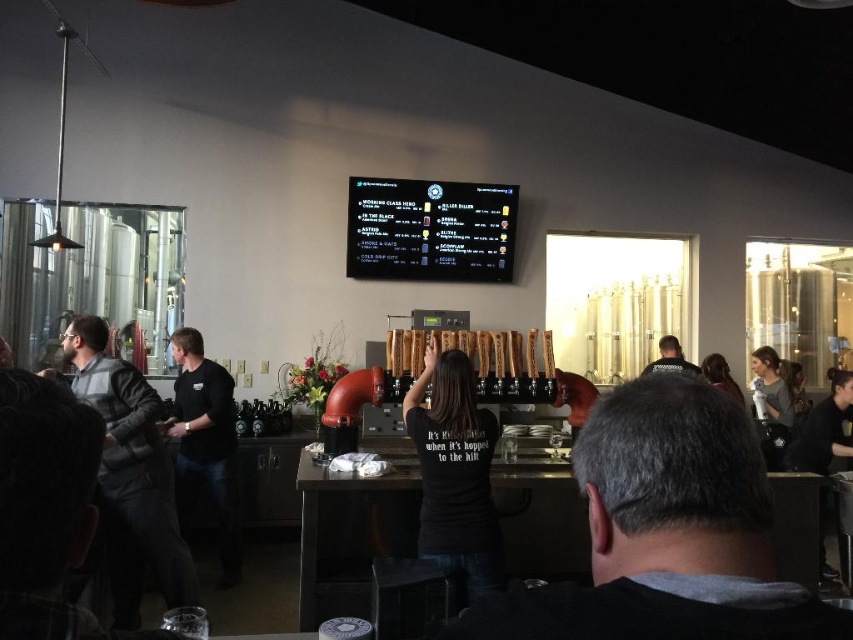
Question: Which object is closer to the camera taking this photo?

Choices:
 (A) wooden stool at lower center
 (B) dark brown hair at upper right
 (C) black matte shirt at left
 (D) black glossy digital display at upper center

Answer: (A)

Question: Which of the following is the closest to the observer?

Choices:
 (A) click(401, 605)
 (B) click(173, 468)

Answer: (A)

Question: Is the position of wooden stool at lower center less distant than that of dark brown hair at upper right?

Choices:
 (A) yes
 (B) no

Answer: (A)

Question: Is wooden stool at lower center to the left of dark brown hair at upper right from the viewer's perspective?

Choices:
 (A) yes
 (B) no

Answer: (A)

Question: From the image, what is the correct spatial relationship of black glossy digital display at upper center in relation to gray fabric shirt at upper right?

Choices:
 (A) left
 (B) right

Answer: (A)

Question: Which point is farther from the camera taking this photo?

Choices:
 (A) (506, 278)
 (B) (215, 365)
 (C) (465, 540)

Answer: (A)